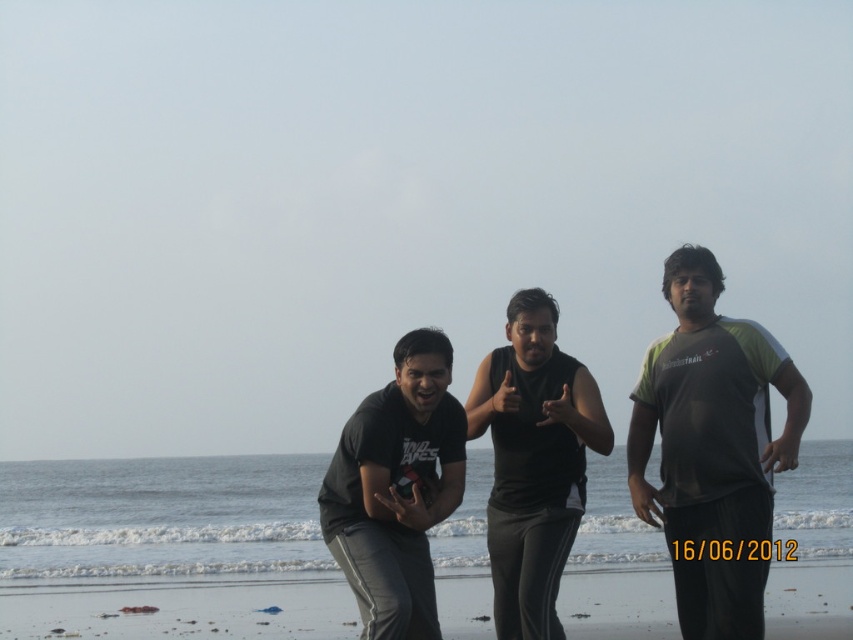
Can you confirm if black matte tank top at center is positioned above black matte t-shirt at center?

Actually, black matte tank top at center is below black matte t-shirt at center.

Does black matte tank top at center have a greater height compared to black matte t-shirt at center?

Correct, black matte tank top at center is much taller as black matte t-shirt at center.

Is point (593, 412) positioned behind point (389, 392)?

Yes, it is.

Where is `black matte tank top at center`? The height and width of the screenshot is (640, 853). black matte tank top at center is located at coordinates (532, 461).

Which is behind, point (468, 589) or point (355, 413)?

The point (468, 589) is behind.

Who is more distant from viewer, (621, 636) or (439, 444)?

The point (621, 636) is behind.

Find the location of a particular element. smooth sand at lower center is located at coordinates (181, 609).

Is smooth sand at lower center shorter than black matte tank top at center?

Yes, smooth sand at lower center is shorter than black matte tank top at center.

Can you confirm if smooth sand at lower center is thinner than black matte tank top at center?

Incorrect, smooth sand at lower center's width is not less than black matte tank top at center's.

Between point (225, 627) and point (556, 321), which one is positioned in front?

Point (556, 321)

Locate an element on the screen. Image resolution: width=853 pixels, height=640 pixels. smooth sand at lower center is located at coordinates click(181, 609).